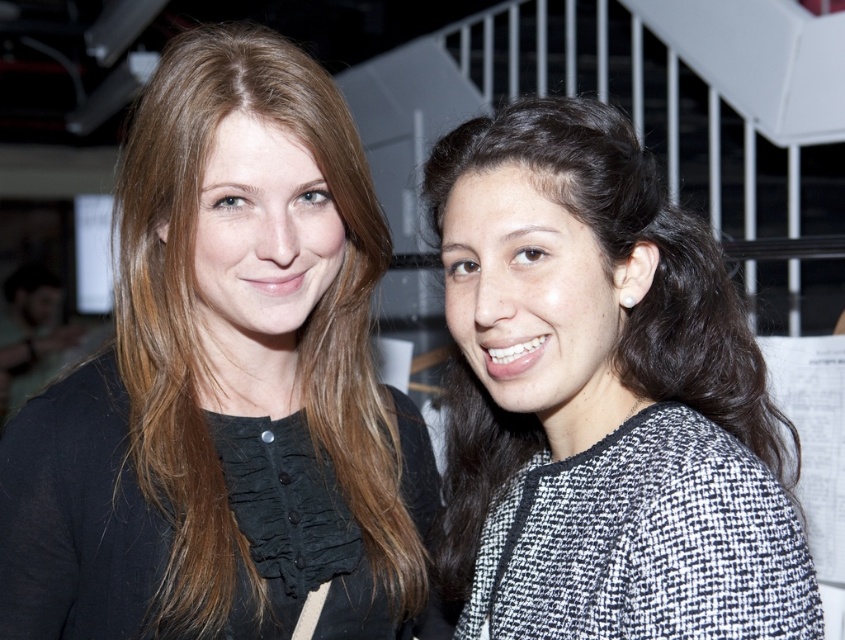
You are a photographer standing at a distance and want to take a closeup shot of the matte black blouse at center. The camera you are using has a minimum focusing distance of 30 inches. Can you take the photo without moving closer?

The matte black blouse at center and viewer are 33.66 inches apart from each other, which is beyond the camera minimum focusing distance of 30 inches. Therefore, you can take the photo without moving closer.

You are a photographer adjusting your camera settings to focus on the matte black blouse at center and the black textured sweater at right. Which one should you focus on first if you want to ensure the closest object is in sharp focus?

The matte black blouse at center should be focused on first because it is closer to the viewer than the black textured sweater at right, ensuring sharp focus on the nearest object.